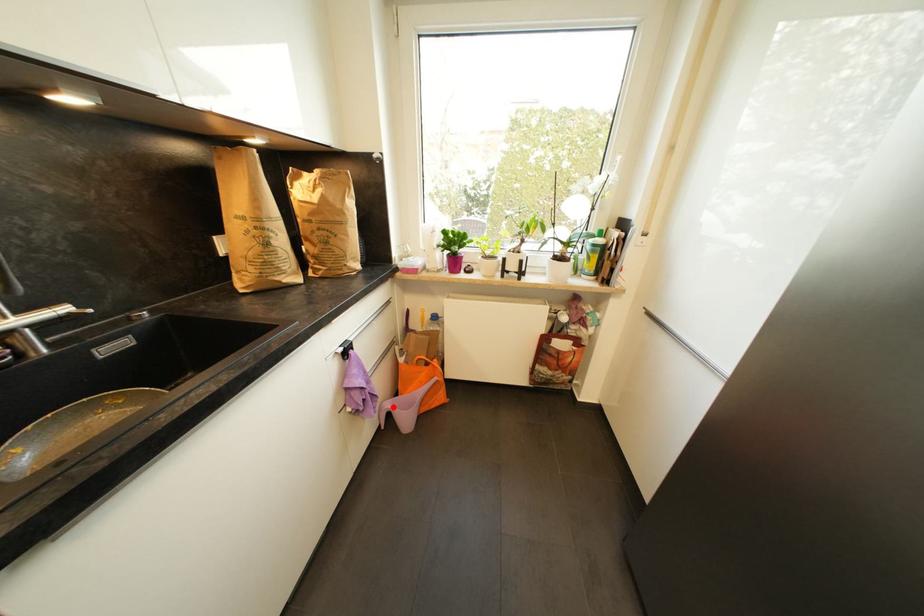
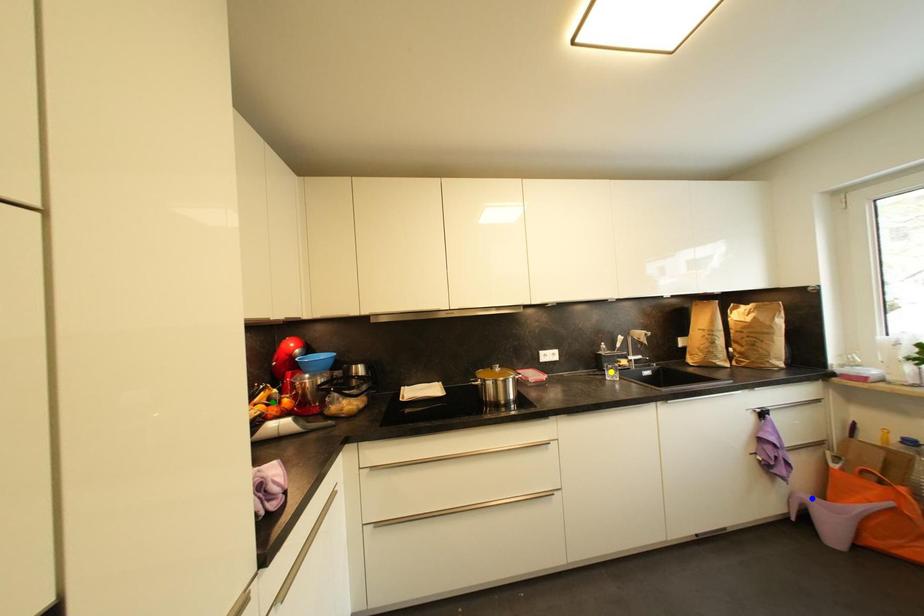
Question: I am providing you with two images of the same scene from different viewpoints. A red point is marked on the first image. You are given multiple points on the second image. In image 2, which mark is for the same physical point as the one in image 1?

Choices:
 (A) blue point
 (B) yellow point
 (C) green point

Answer: (A)